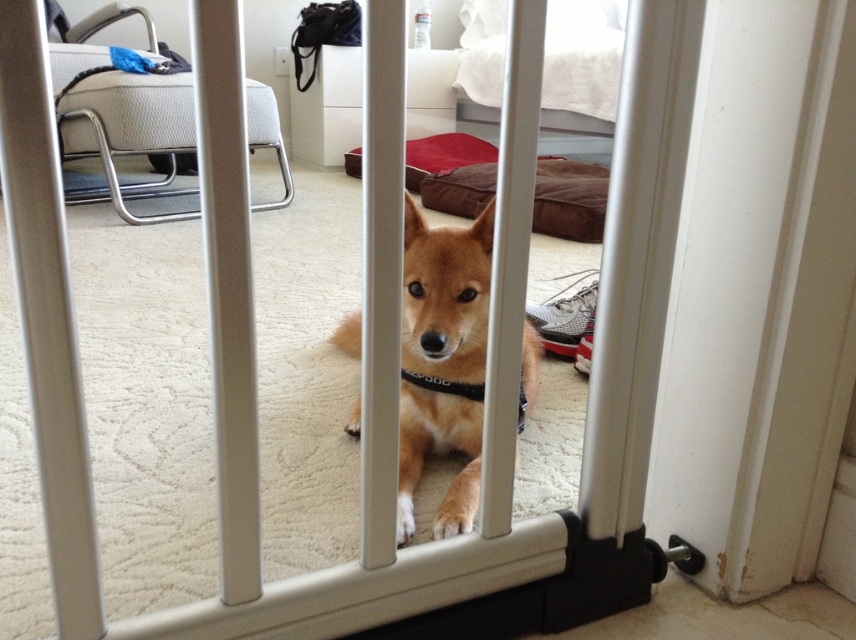
Which is more to the right, golden fur dog at center or brown plush dog bed at center?

brown plush dog bed at center is more to the right.

Is the position of golden fur dog at center less distant than that of brown plush dog bed at center?

That is True.

Is point (342, 336) positioned before point (541, 182)?

Yes, point (342, 336) is closer to viewer.

Identify the location of golden fur dog at center. This screenshot has width=856, height=640. (444, 296).

Between brown plush dog bed at center and black fabric neckband at center, which one has more height?

brown plush dog bed at center

Is brown plush dog bed at center closer to the viewer compared to black fabric neckband at center?

No, brown plush dog bed at center is further to the viewer.

Which is in front, point (569, 205) or point (521, 394)?

Point (521, 394) is in front.

Image resolution: width=856 pixels, height=640 pixels. I want to click on brown plush dog bed at center, so click(569, 198).

Which is in front, point (450, 353) or point (526, 400)?

Positioned in front is point (450, 353).

Is golden fur dog at center to the right of black fabric neckband at center from the viewer's perspective?

Incorrect, golden fur dog at center is not on the right side of black fabric neckband at center.

I want to click on golden fur dog at center, so click(x=444, y=296).